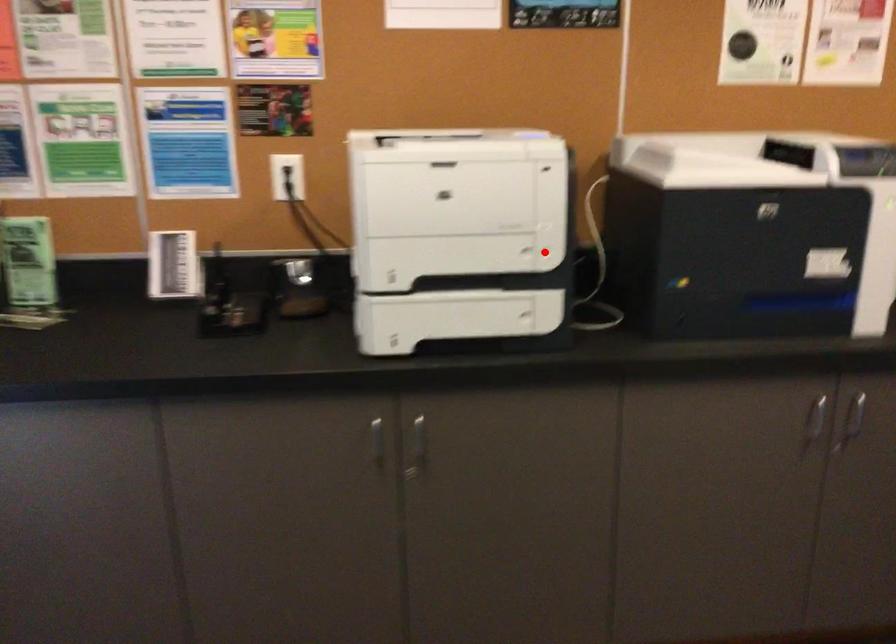
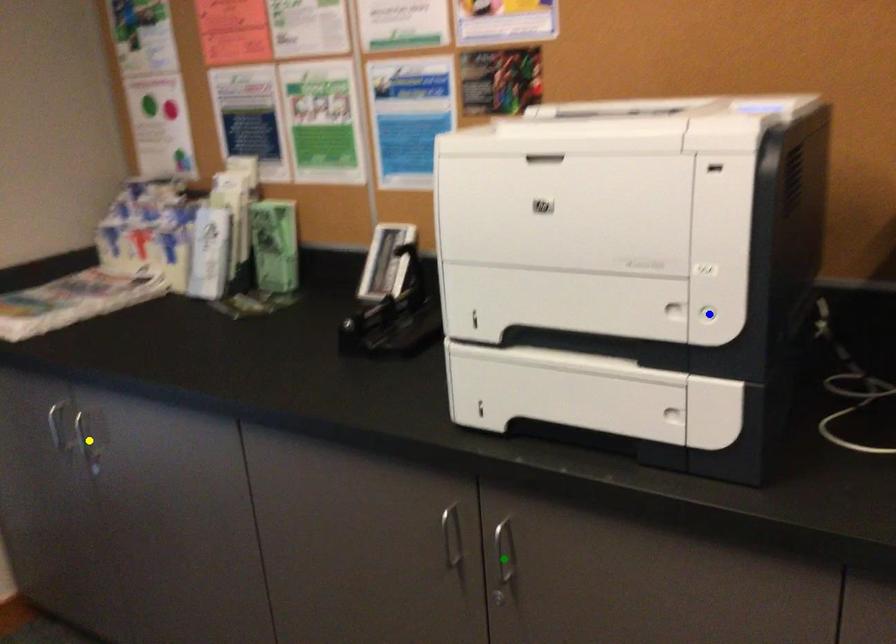
Question: I am providing you with two images of the same scene from different viewpoints. A red point is marked on the first image. You are given multiple points on the second image. Which point in image 2 represents the same 3d spot as the red point in image 1?

Choices:
 (A) green point
 (B) blue point
 (C) yellow point

Answer: (B)